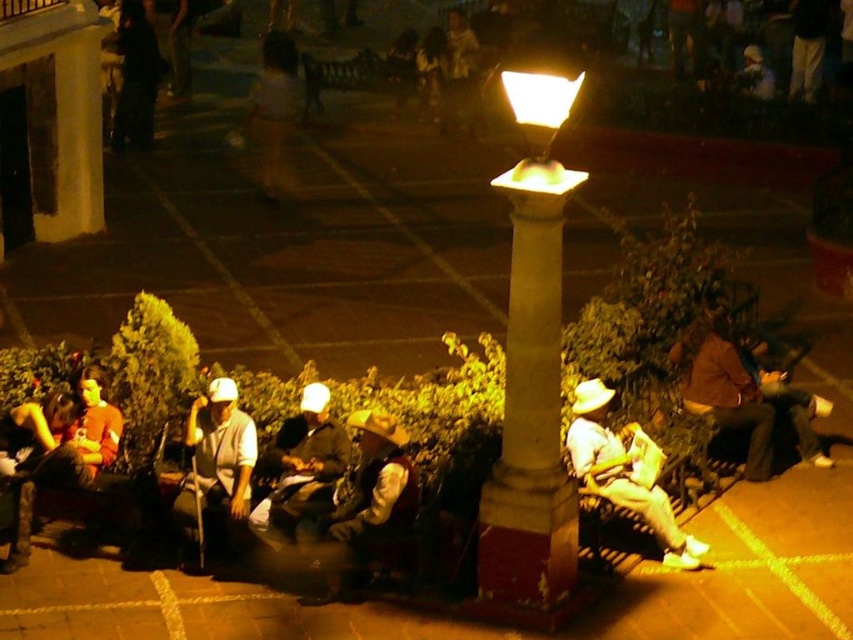
Question: Does white marble column at center have a lesser width compared to white fabric shirt at center?

Choices:
 (A) no
 (B) yes

Answer: (A)

Question: Considering the relative positions of camouflage fabric construction worker at center and brown leather jacket at right in the image provided, where is camouflage fabric construction worker at center located with respect to brown leather jacket at right?

Choices:
 (A) above
 (B) below

Answer: (B)

Question: Among these points, which one is nearest to the camera?

Choices:
 (A) (601, 452)
 (B) (398, 516)
 (C) (756, 397)
 (D) (250, 424)

Answer: (B)

Question: Which object appears farthest from the camera in this image?

Choices:
 (A) light brown leather jacket at center
 (B) white fabric shirt at center

Answer: (A)

Question: Is camouflage fabric construction worker at center bigger than brown leather jacket at right?

Choices:
 (A) yes
 (B) no

Answer: (A)

Question: Which object is farther from the camera taking this photo?

Choices:
 (A) light brown leather jacket at center
 (B) white matte hat at center
 (C) camouflage fabric construction worker at center

Answer: (B)